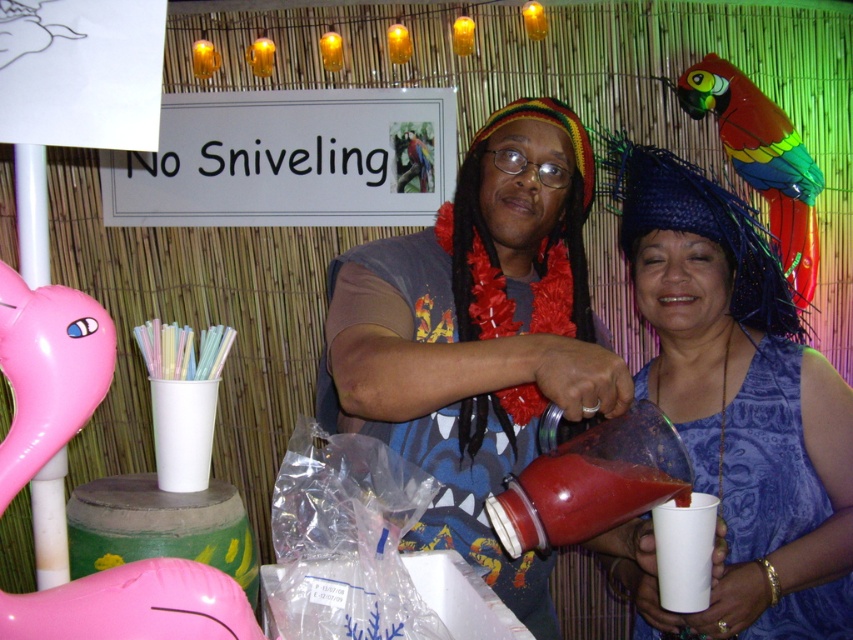
Question: Does matte plastic cup at center appear on the left side of rainbow feathered parrot at upper right?

Choices:
 (A) no
 (B) yes

Answer: (B)

Question: Does matte plastic cup at center lie behind rainbow feathered parrot at upper right?

Choices:
 (A) no
 (B) yes

Answer: (A)

Question: Is matte plastic cup at center above blue fabric dress at center?

Choices:
 (A) yes
 (B) no

Answer: (B)

Question: Among these objects, which one is nearest to the camera?

Choices:
 (A) rainbow feathered parrot at upper right
 (B) blue fabric dress at center

Answer: (B)

Question: Which point is closer to the camera?

Choices:
 (A) rainbow feathered parrot at upper right
 (B) blue fabric dress at center

Answer: (B)

Question: Which is nearer to the matte plastic cup at center?

Choices:
 (A) blue fabric dress at center
 (B) rainbow feathered parrot at upper right

Answer: (A)